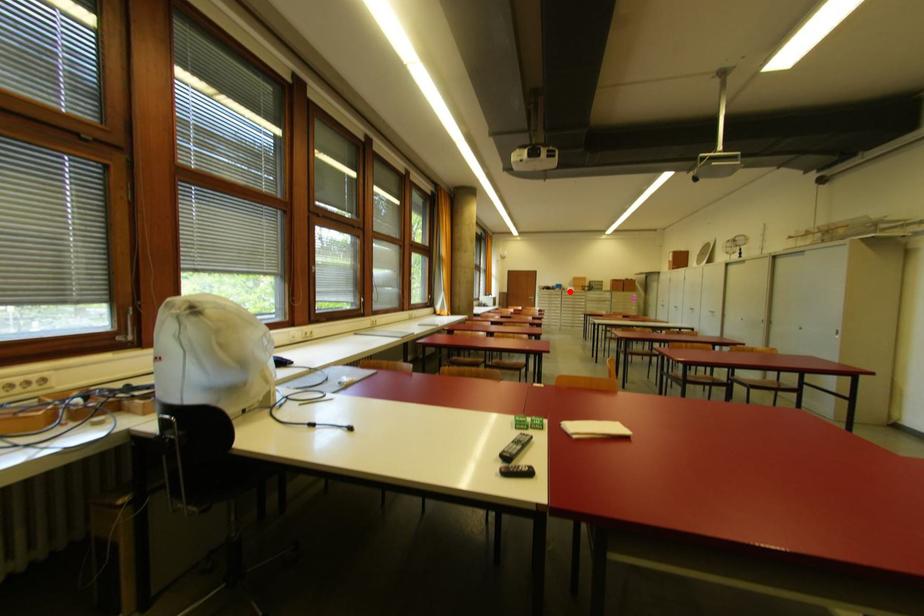
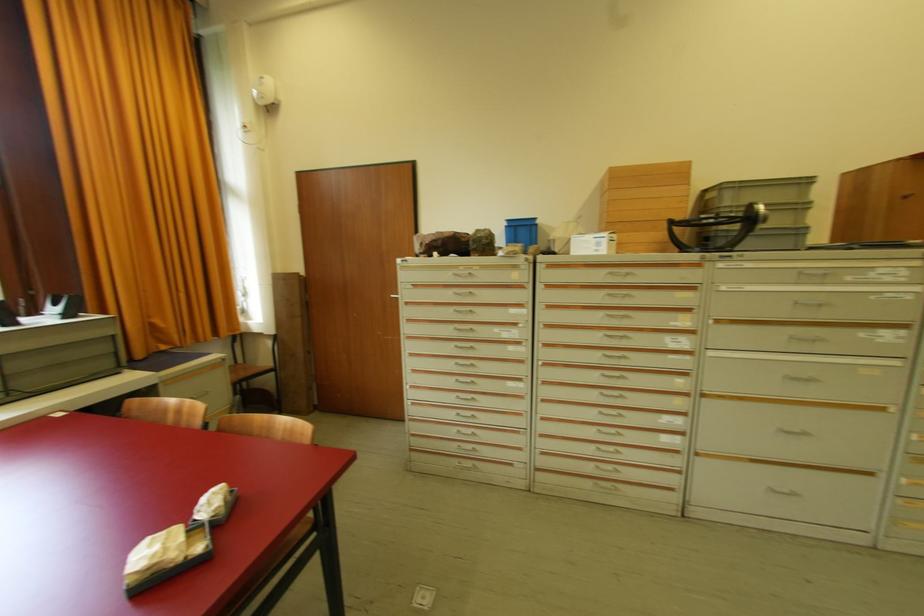
Where in the second image is the point corresponding to the highlighted location from the first image?

(570, 254)